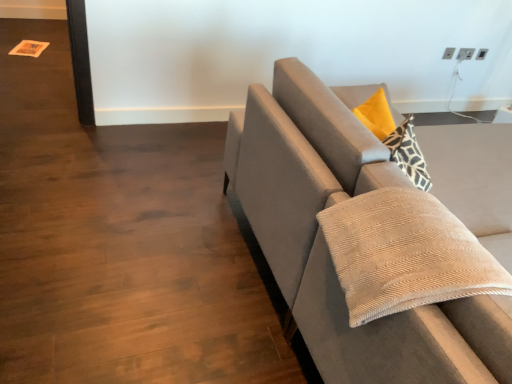
Question: Is beige corduroy pillow at right taller or shorter than velvet gray couch at right?

Choices:
 (A) short
 (B) tall

Answer: (A)

Question: Would you say beige corduroy pillow at right is inside or outside velvet gray couch at right?

Choices:
 (A) outside
 (B) inside

Answer: (A)

Question: From a real-world perspective, is beige corduroy pillow at right above or below velvet gray couch at right?

Choices:
 (A) above
 (B) below

Answer: (A)

Question: Considering the relative positions of velvet gray couch at right and beige corduroy pillow at right in the image provided, is velvet gray couch at right to the left or to the right of beige corduroy pillow at right?

Choices:
 (A) right
 (B) left

Answer: (A)

Question: From the image's perspective, is velvet gray couch at right positioned above or below beige corduroy pillow at right?

Choices:
 (A) above
 (B) below

Answer: (A)

Question: Considering the positions of point (415, 349) and point (399, 248), is point (415, 349) closer or farther from the camera than point (399, 248)?

Choices:
 (A) farther
 (B) closer

Answer: (B)

Question: Is velvet gray couch at right situated inside beige corduroy pillow at right or outside?

Choices:
 (A) inside
 (B) outside

Answer: (B)